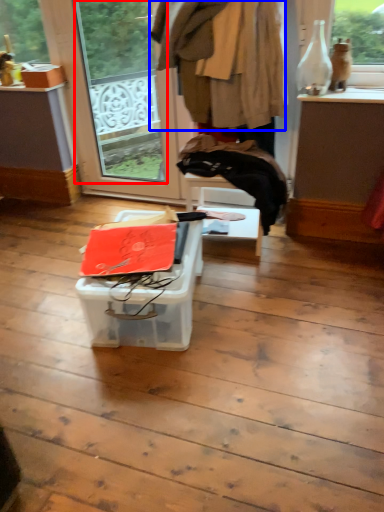
Question: Among these objects, which one is nearest to the camera, window screen (highlighted by a red box) or clothing (highlighted by a blue box)?

Choices:
 (A) window screen
 (B) clothing

Answer: (B)